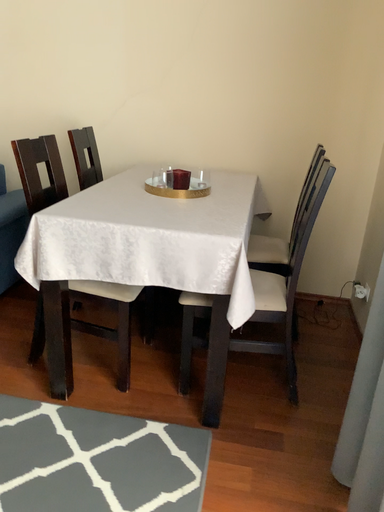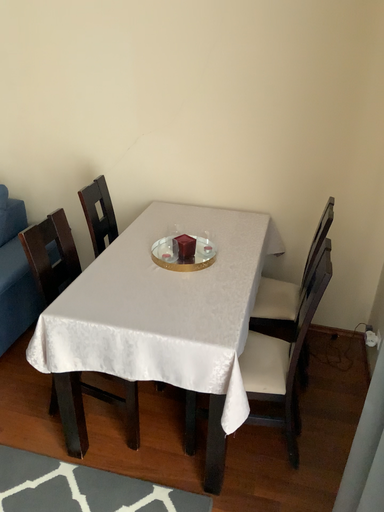
Question: How did the camera likely rotate when shooting the video?

Choices:
 (A) rotated downward
 (B) rotated upward

Answer: (A)